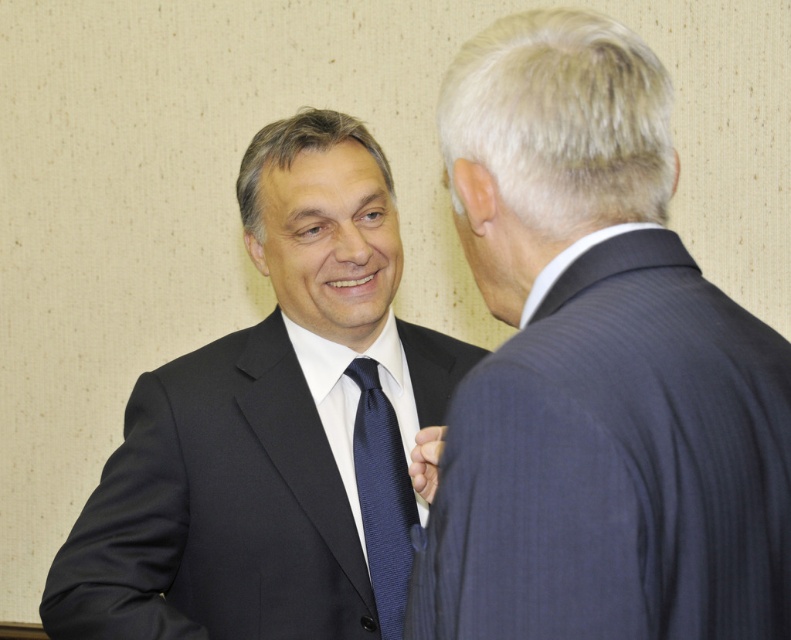
Between dark blue pinstripe suit at right and navy silk tie at center, which one has less height?

navy silk tie at center

Between dark blue pinstripe suit at right and navy silk tie at center, which one appears on the left side from the viewer's perspective?

From the viewer's perspective, navy silk tie at center appears more on the left side.

Locate an element on the screen. The image size is (791, 640). dark blue pinstripe suit at right is located at coordinates (596, 371).

At what (x,y) coordinates should I click in order to perform the action: click on dark blue pinstripe suit at right. Please return your answer as a coordinate pair (x, y). Looking at the image, I should click on (596, 371).

Does dark blue pinstripe suit at right come behind matte black suit at center?

That is False.

Between point (698, 460) and point (458, 362), which one is positioned in front?

Positioned in front is point (698, 460).

Which is behind, point (451, 621) or point (284, 148)?

Positioned behind is point (284, 148).

At what (x,y) coordinates should I click in order to perform the action: click on dark blue pinstripe suit at right. Please return your answer as a coordinate pair (x, y). Looking at the image, I should click on (596, 371).

Does matte black suit at center appear on the right side of navy silk tie at center?

In fact, matte black suit at center is to the left of navy silk tie at center.

Is matte black suit at center below navy silk tie at center?

Actually, matte black suit at center is above navy silk tie at center.

Find the location of `matte black suit at center`. matte black suit at center is located at coordinates (275, 429).